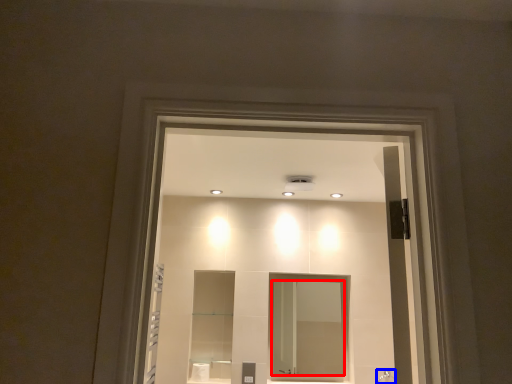
Question: Which of the following is the closest to the observer, mirror (highlighted by a red box) or shower (highlighted by a blue box)?

Choices:
 (A) mirror
 (B) shower

Answer: (B)